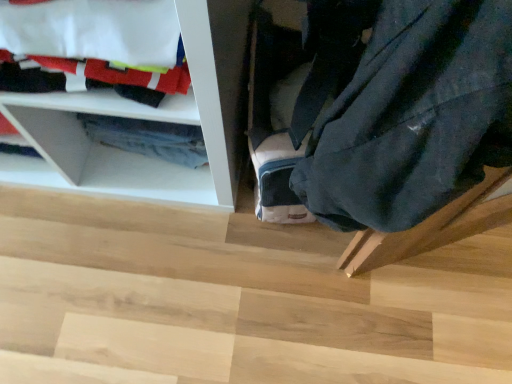
Question: Is dark blue fabric at lower right at the back of wooden step at lower right?

Choices:
 (A) no
 (B) yes

Answer: (A)

Question: Is the position of wooden step at lower right less distant than that of dark blue fabric at lower right?

Choices:
 (A) no
 (B) yes

Answer: (A)

Question: Does wooden step at lower right have a lesser height compared to dark blue fabric at lower right?

Choices:
 (A) yes
 (B) no

Answer: (A)

Question: Considering the relative sizes of wooden step at lower right and dark blue fabric at lower right in the image provided, is wooden step at lower right smaller than dark blue fabric at lower right?

Choices:
 (A) yes
 (B) no

Answer: (B)

Question: From a real-world perspective, is wooden step at lower right positioned under dark blue fabric at lower right based on gravity?

Choices:
 (A) no
 (B) yes

Answer: (B)

Question: Would you say white fabric at upper left is inside or outside dark blue fabric at lower right?

Choices:
 (A) outside
 (B) inside

Answer: (A)

Question: Considering their positions, is white fabric at upper left located in front of or behind dark blue fabric at lower right?

Choices:
 (A) front
 (B) behind

Answer: (B)

Question: From a real-world perspective, is white fabric at upper left above or below dark blue fabric at lower right?

Choices:
 (A) below
 (B) above

Answer: (A)

Question: From the image's perspective, is white fabric at upper left located above or below dark blue fabric at lower right?

Choices:
 (A) below
 (B) above

Answer: (B)

Question: Is white fabric at upper left inside or outside of wooden step at lower right?

Choices:
 (A) inside
 (B) outside

Answer: (B)

Question: From a real-world perspective, is white fabric at upper left positioned above or below wooden step at lower right?

Choices:
 (A) above
 (B) below

Answer: (A)

Question: From the image's perspective, relative to wooden step at lower right, is white fabric at upper left above or below?

Choices:
 (A) below
 (B) above

Answer: (B)

Question: Considering the positions of white fabric at upper left and wooden step at lower right in the image, is white fabric at upper left taller or shorter than wooden step at lower right?

Choices:
 (A) short
 (B) tall

Answer: (B)

Question: Based on their sizes in the image, would you say wooden step at lower right is bigger or smaller than white fabric at upper left?

Choices:
 (A) big
 (B) small

Answer: (A)

Question: Considering the positions of wooden step at lower right and white fabric at upper left in the image, is wooden step at lower right wider or thinner than white fabric at upper left?

Choices:
 (A) wide
 (B) thin

Answer: (A)